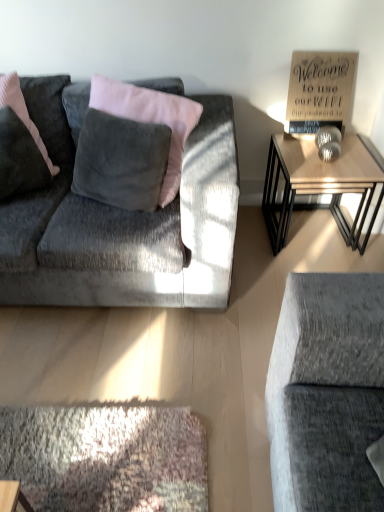
Question: Considering the positions of wooden sign at upper right and wooden table at right in the image, is wooden sign at upper right taller or shorter than wooden table at right?

Choices:
 (A) tall
 (B) short

Answer: (B)

Question: Is point (321, 80) closer or farther from the camera than point (278, 144)?

Choices:
 (A) closer
 (B) farther

Answer: (A)

Question: Considering the real-world distances, which object is farthest from the velvet gray couch at left?

Choices:
 (A) wooden sign at upper right
 (B) velvet dark gray pillow at left
 (C) wooden table at right

Answer: (A)

Question: Which object is positioned farthest from the velvet gray couch at left?

Choices:
 (A) velvet dark gray pillow at left
 (B) wooden sign at upper right
 (C) wooden table at right

Answer: (B)